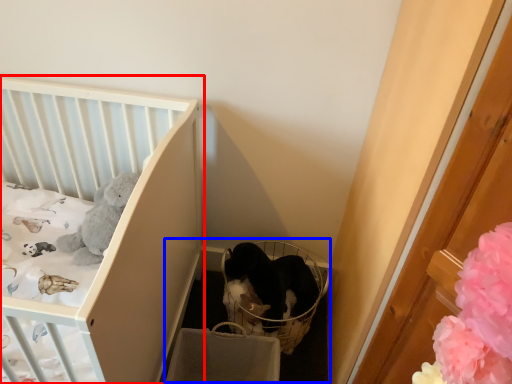
Question: Which point is further to the camera, infant bed (highlighted by a red box) or baby carriage (highlighted by a blue box)?

Choices:
 (A) infant bed
 (B) baby carriage

Answer: (B)